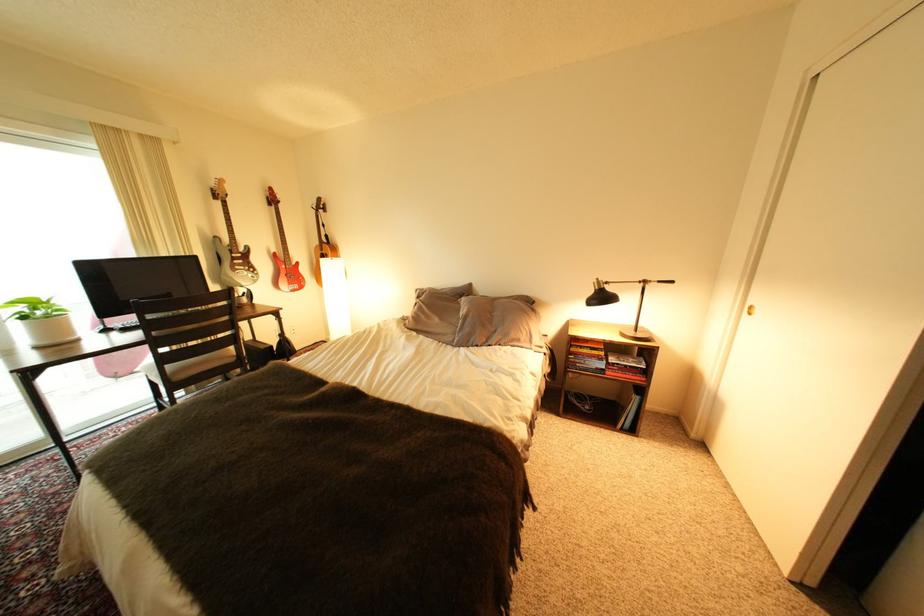
Image resolution: width=924 pixels, height=616 pixels. I want to click on grey pillow, so click(484, 315).